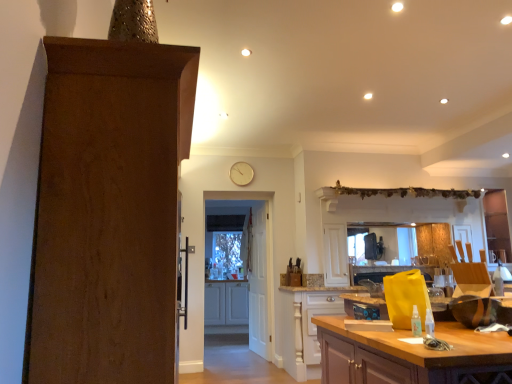
Question: From a real-world perspective, is white wooden door at center, the second door from the back, physically located above or below wooden countertop at lower right, the third cabinetry from the back?

Choices:
 (A) below
 (B) above

Answer: (B)

Question: In terms of size, does white wooden door at center, the second door from the back, appear bigger or smaller than wooden countertop at lower right, the third cabinetry from the back?

Choices:
 (A) small
 (B) big

Answer: (A)

Question: Based on their relative distances, which object is nearer to the wooden countertop at lower right, the first cabinetry when ordered from right to left?

Choices:
 (A) light brown wood cabinet at center, positioned as the second cabinetry in back-to-front order
 (B) white wooden door at center, the second door from the back
 (C) gold metallic clock at upper center
 (D) brown wood door at left, the third door when ordered from back to front
 (E) white wooden door at center, the 1th door in the back-to-front sequence

Answer: (D)

Question: Which of these objects is positioned farthest from the white wooden door at center, the third door positioned from the front?

Choices:
 (A) brown wood door at left, the third door when ordered from back to front
 (B) light brown wood cabinet at center, the 2th cabinetry when ordered from right to left
 (C) white matte cabinet at center, which is the third cabinetry in right-to-left order
 (D) white wooden door at center, the second door from the back
 (E) wooden countertop at lower right, the third cabinetry viewed from the left

Answer: (A)